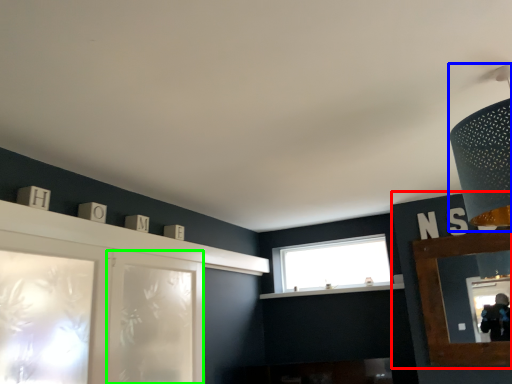
Question: Which object is positioned closest to cabinetry (highlighted by a red box)? Select from light fixture (highlighted by a blue box) and screen door (highlighted by a green box).

Choices:
 (A) light fixture
 (B) screen door

Answer: (A)